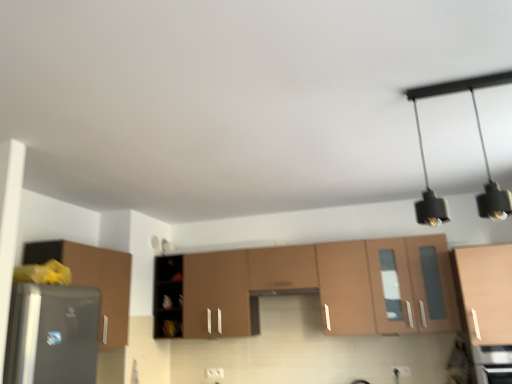
Question: From a real-world perspective, is matte brown cabinet at center, the 2th cabinetry viewed from the left, on top of matte wood cabinet at right, which ranks as the first cabinetry in right-to-left order?

Choices:
 (A) yes
 (B) no

Answer: (A)

Question: From the image's perspective, does matte brown cabinet at center, arranged as the 2th cabinetry when viewed from the right, appear lower than matte wood cabinet at right, which ranks as the first cabinetry in right-to-left order?

Choices:
 (A) no
 (B) yes

Answer: (B)

Question: Is matte brown cabinet at center, arranged as the 2th cabinetry when viewed from the right, turned away from matte wood cabinet at right, which ranks as the third cabinetry in left-to-right order?

Choices:
 (A) yes
 (B) no

Answer: (B)

Question: Considering the relative sizes of matte brown cabinet at center, arranged as the 2th cabinetry when viewed from the right, and matte wood cabinet at right, which ranks as the third cabinetry in left-to-right order, in the image provided, is matte brown cabinet at center, arranged as the 2th cabinetry when viewed from the right, smaller than matte wood cabinet at right, which ranks as the third cabinetry in left-to-right order,?

Choices:
 (A) yes
 (B) no

Answer: (B)

Question: From the image's perspective, is matte brown cabinet at center, the 2th cabinetry viewed from the left, located above matte wood cabinet at right, which ranks as the third cabinetry in left-to-right order?

Choices:
 (A) yes
 (B) no

Answer: (B)

Question: Considering the relative sizes of matte brown cabinet at center, the 2th cabinetry viewed from the left, and matte wood cabinet at right, which ranks as the third cabinetry in left-to-right order, in the image provided, is matte brown cabinet at center, the 2th cabinetry viewed from the left, shorter than matte wood cabinet at right, which ranks as the third cabinetry in left-to-right order,?

Choices:
 (A) no
 (B) yes

Answer: (A)

Question: From a real-world perspective, is matte wood cabinet at right, which ranks as the first cabinetry in right-to-left order, on matte brown cabinet at left, acting as the first cabinetry starting from the left?

Choices:
 (A) no
 (B) yes

Answer: (A)

Question: Does matte wood cabinet at right, which ranks as the first cabinetry in right-to-left order, appear on the right side of matte brown cabinet at left, arranged as the 3th cabinetry when viewed from the right?

Choices:
 (A) yes
 (B) no

Answer: (A)

Question: Are matte wood cabinet at right, which ranks as the first cabinetry in right-to-left order, and matte brown cabinet at left, acting as the first cabinetry starting from the left, located far from each other?

Choices:
 (A) no
 (B) yes

Answer: (B)

Question: From the image's perspective, would you say matte wood cabinet at right, which ranks as the first cabinetry in right-to-left order, is positioned over matte brown cabinet at left, acting as the first cabinetry starting from the left?

Choices:
 (A) yes
 (B) no

Answer: (A)

Question: Can you confirm if matte wood cabinet at right, which ranks as the third cabinetry in left-to-right order, is shorter than matte brown cabinet at left, arranged as the 3th cabinetry when viewed from the right?

Choices:
 (A) no
 (B) yes

Answer: (B)

Question: Is matte wood cabinet at right, which ranks as the third cabinetry in left-to-right order, completely or partially outside of matte brown cabinet at left, arranged as the 3th cabinetry when viewed from the right?

Choices:
 (A) no
 (B) yes

Answer: (B)

Question: Is the depth of satin black oven at lower right greater than that of black matte light fixture at upper right?

Choices:
 (A) no
 (B) yes

Answer: (B)